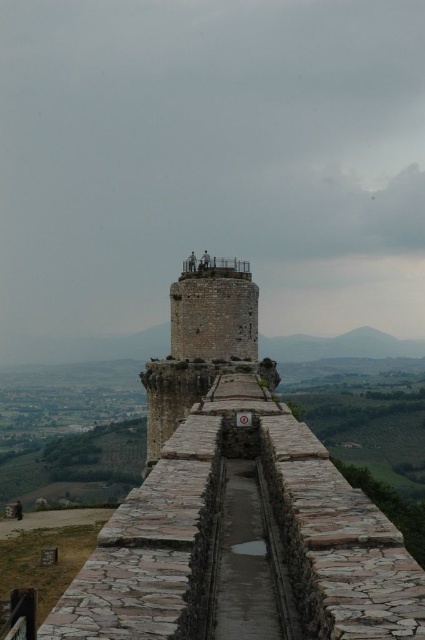
Question: Among these points, which one is farthest from the camera?

Choices:
 (A) (226, 337)
 (B) (356, 564)

Answer: (A)

Question: In this image, where is stone tower at center located relative to rustic stone tower at center?

Choices:
 (A) below
 (B) above

Answer: (A)

Question: Which of the following is the closest to the observer?

Choices:
 (A) (370, 512)
 (B) (195, 289)

Answer: (A)

Question: Does stone tower at center appear on the right side of rustic stone tower at center?

Choices:
 (A) yes
 (B) no

Answer: (A)

Question: Which point is farther from the camera taking this photo?

Choices:
 (A) (209, 534)
 (B) (183, 344)

Answer: (B)

Question: Is stone tower at center above rustic stone tower at center?

Choices:
 (A) no
 (B) yes

Answer: (A)